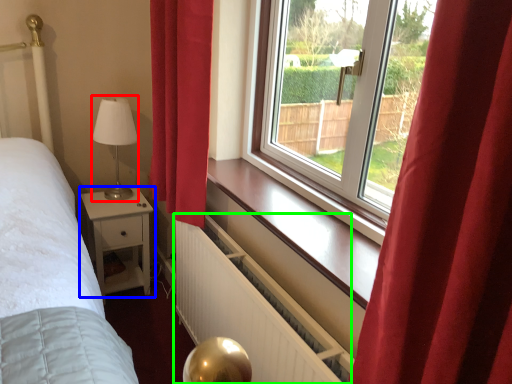
Question: Which object is the farthest from table lamp (highlighted by a red box)? Choose among these: nightstand (highlighted by a blue box) or radiator (highlighted by a green box).

Choices:
 (A) nightstand
 (B) radiator

Answer: (B)